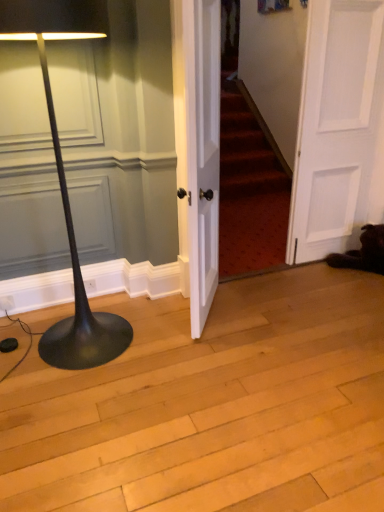
Question: Considering the relative sizes of white wood door at center, the second door when ordered from right to left, and black matte floor lamp at left in the image provided, is white wood door at center, the second door when ordered from right to left, bigger than black matte floor lamp at left?

Choices:
 (A) no
 (B) yes

Answer: (A)

Question: Is white wood door at center, the first door positioned from the left, closer to the viewer compared to black matte floor lamp at left?

Choices:
 (A) no
 (B) yes

Answer: (A)

Question: From the image's perspective, is white wood door at center, the second door when ordered from right to left, over black matte floor lamp at left?

Choices:
 (A) yes
 (B) no

Answer: (A)

Question: Considering the relative positions of white wood door at center, the second door when ordered from right to left, and black matte floor lamp at left in the image provided, is white wood door at center, the second door when ordered from right to left, to the left of black matte floor lamp at left from the viewer's perspective?

Choices:
 (A) yes
 (B) no

Answer: (B)

Question: Is white wood door at center, the first door positioned from the left, shorter than black matte floor lamp at left?

Choices:
 (A) no
 (B) yes

Answer: (B)

Question: Considering their positions, is black matte floor lamp at left located in front of or behind white wood door at center, the first door positioned from the left?

Choices:
 (A) front
 (B) behind

Answer: (A)

Question: Which is correct: black matte floor lamp at left is inside white wood door at center, the first door positioned from the left, or outside of it?

Choices:
 (A) inside
 (B) outside

Answer: (B)

Question: In terms of height, does black matte floor lamp at left look taller or shorter compared to white wood door at center, the second door when ordered from right to left?

Choices:
 (A) short
 (B) tall

Answer: (B)

Question: From the image's perspective, is black matte floor lamp at left above or below white wood door at center, the second door when ordered from right to left?

Choices:
 (A) below
 (B) above

Answer: (A)

Question: In the image, is black matte floor lamp at left positioned in front of or behind white matte door at right, which is counted as the 2th door, starting from the left?

Choices:
 (A) behind
 (B) front

Answer: (B)

Question: From a real-world perspective, is black matte floor lamp at left positioned above or below white matte door at right, acting as the 1th door starting from the right?

Choices:
 (A) below
 (B) above

Answer: (A)

Question: Would you say black matte floor lamp at left is to the left or to the right of white matte door at right, which is counted as the 2th door, starting from the left, in the picture?

Choices:
 (A) right
 (B) left

Answer: (B)

Question: Considering the positions of black matte floor lamp at left and white matte door at right, acting as the 1th door starting from the right, in the image, is black matte floor lamp at left bigger or smaller than white matte door at right, acting as the 1th door starting from the right,?

Choices:
 (A) small
 (B) big

Answer: (B)

Question: In the image, is white wood door at center, the first door positioned from the left, positioned in front of or behind white matte door at right, acting as the 1th door starting from the right?

Choices:
 (A) front
 (B) behind

Answer: (A)

Question: Is point (213, 130) closer or farther from the camera than point (370, 166)?

Choices:
 (A) closer
 (B) farther

Answer: (A)